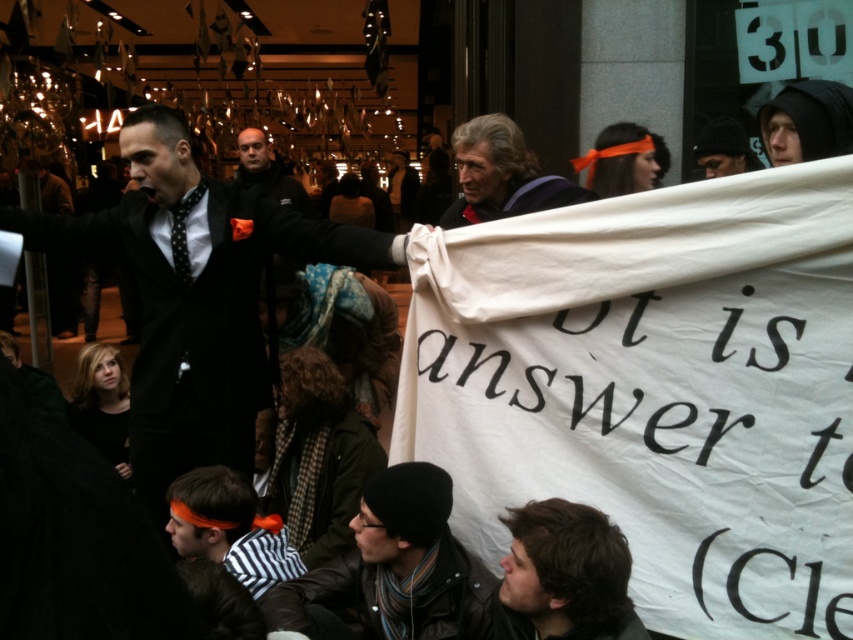
This screenshot has height=640, width=853. What do you see at coordinates (502, 173) in the screenshot?
I see `gray woolen scarf at center` at bounding box center [502, 173].

Based on the photo, can you confirm if gray woolen scarf at center is taller than dark gray jacket at center?

In fact, gray woolen scarf at center may be shorter than dark gray jacket at center.

Between point (561, 204) and point (281, 186), which one is positioned behind?

The point (281, 186) is behind.

Where is `gray woolen scarf at center`? gray woolen scarf at center is located at coordinates (502, 173).

Between dark brown hair at lower right and gray woolen scarf at center, which one appears on the left side from the viewer's perspective?

Positioned to the left is dark brown hair at lower right.

Based on the photo, is the position of dark brown hair at lower right less distant than that of gray woolen scarf at center?

Yes, dark brown hair at lower right is in front of gray woolen scarf at center.

Image resolution: width=853 pixels, height=640 pixels. I want to click on dark brown hair at lower right, so click(x=564, y=576).

Is black knit cap at lower center above black knit cap at upper right?

No, black knit cap at lower center is not above black knit cap at upper right.

Who is taller, black knit cap at lower center or black knit cap at upper right?

black knit cap at lower center is taller.

Find the location of a particular element. black knit cap at lower center is located at coordinates (395, 566).

Identify the location of black knit cap at lower center. (395, 566).